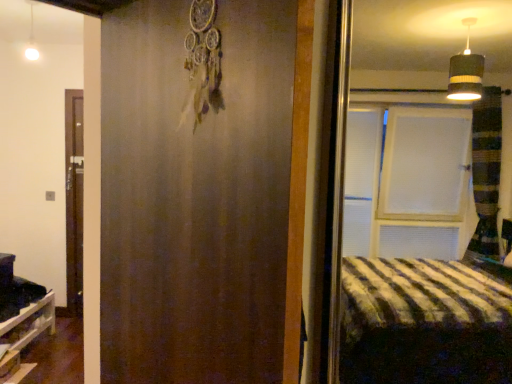
Question: From their relative heights in the image, would you say white glossy light fixture at upper left is taller or shorter than matte brown barn door at center?

Choices:
 (A) short
 (B) tall

Answer: (A)

Question: Is white glossy light fixture at upper left in front of or behind matte brown barn door at center in the image?

Choices:
 (A) front
 (B) behind

Answer: (B)

Question: Which object is the closest to the matte brown barn door at center?

Choices:
 (A) white glossy light fixture at upper left
 (B) white wooden shelf at lower left

Answer: (B)

Question: Based on their relative distances, which object is nearer to the white wooden shelf at lower left?

Choices:
 (A) matte brown barn door at center
 (B) white glossy light fixture at upper left

Answer: (B)